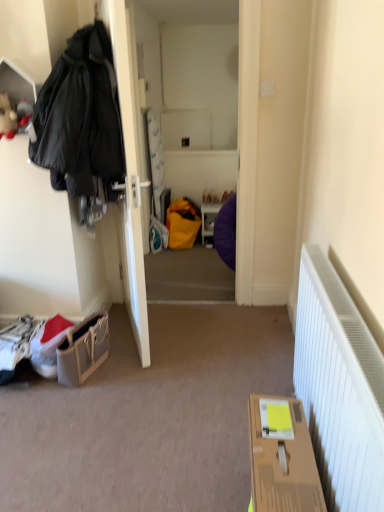
Question: Considering the relative sizes of matte white door at left and matte purple bean bag at center in the image provided, is matte white door at left wider than matte purple bean bag at center?

Choices:
 (A) no
 (B) yes

Answer: (B)

Question: Can you confirm if matte white door at left is positioned to the right of matte purple bean bag at center?

Choices:
 (A) yes
 (B) no

Answer: (B)

Question: Is matte white door at left shorter than matte purple bean bag at center?

Choices:
 (A) no
 (B) yes

Answer: (B)

Question: Considering the relative sizes of matte white door at left and matte purple bean bag at center in the image provided, is matte white door at left taller than matte purple bean bag at center?

Choices:
 (A) no
 (B) yes

Answer: (A)

Question: Is matte white door at left not inside matte purple bean bag at center?

Choices:
 (A) no
 (B) yes

Answer: (B)

Question: Considering the positions of leather textured handbag at lower left and matte purple bean bag at center in the image, is leather textured handbag at lower left taller or shorter than matte purple bean bag at center?

Choices:
 (A) tall
 (B) short

Answer: (B)

Question: In the image, is leather textured handbag at lower left on the left side or the right side of matte purple bean bag at center?

Choices:
 (A) right
 (B) left

Answer: (B)

Question: Considering the positions of leather textured handbag at lower left and matte purple bean bag at center in the image, is leather textured handbag at lower left bigger or smaller than matte purple bean bag at center?

Choices:
 (A) small
 (B) big

Answer: (A)

Question: From the image's perspective, is leather textured handbag at lower left positioned above or below matte purple bean bag at center?

Choices:
 (A) above
 (B) below

Answer: (B)

Question: Which is correct: cardboard box at lower right is inside fluffy plush toy at upper left, or outside of it?

Choices:
 (A) inside
 (B) outside

Answer: (B)

Question: Is point (264, 458) closer or farther from the camera than point (13, 133)?

Choices:
 (A) farther
 (B) closer

Answer: (B)

Question: From the image's perspective, is cardboard box at lower right above or below fluffy plush toy at upper left?

Choices:
 (A) above
 (B) below

Answer: (B)

Question: In terms of height, does cardboard box at lower right look taller or shorter compared to fluffy plush toy at upper left?

Choices:
 (A) short
 (B) tall

Answer: (B)

Question: Considering their positions, is cardboard box at lower right located in front of or behind matte black coat at left?

Choices:
 (A) behind
 (B) front

Answer: (B)

Question: Visually, is cardboard box at lower right positioned to the left or to the right of matte black coat at left?

Choices:
 (A) left
 (B) right

Answer: (B)